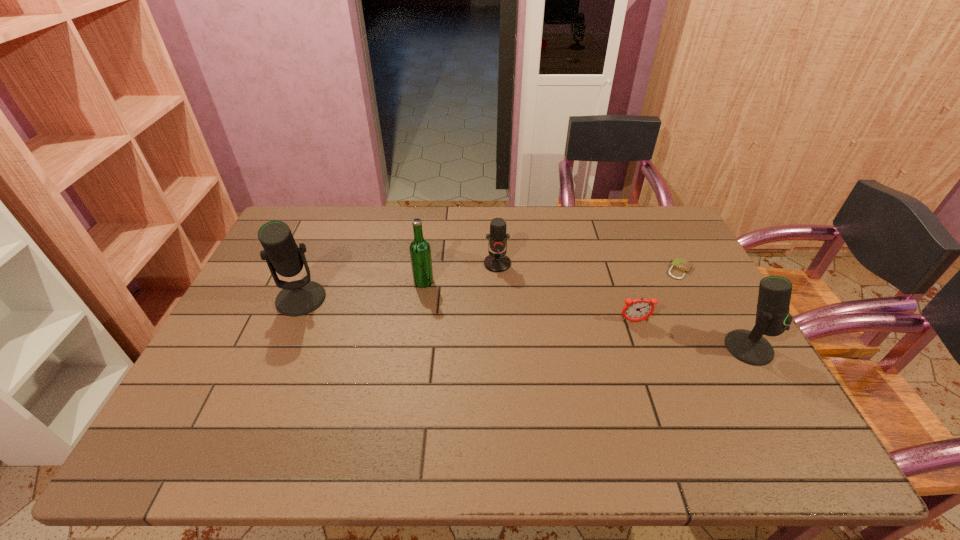
The image size is (960, 540). Identify the location of the tallest microphone. (300, 297).

You are a GUI agent. You are given a task and a screenshot of the screen. Output one action in this format:
    pyautogui.click(x=<x>, y=<y>)
    Task: Click on the second farthest microphone
    The width and height of the screenshot is (960, 540).
    Given the screenshot: What is the action you would take?
    pyautogui.click(x=300, y=297)

Identify the location of the rightmost microphone. (772, 316).

Locate an element on the screen. the nearest microphone is located at coordinates (772, 316).

Locate an element on the screen. This screenshot has width=960, height=540. the second nearest object is located at coordinates (641, 309).

Locate an element on the screen. the fifth tallest object is located at coordinates (641, 309).

Locate an element on the screen. This screenshot has width=960, height=540. beer bottle is located at coordinates (420, 252).

Find the location of a particular element. the second microphone from right to left is located at coordinates (496, 262).

Find the location of a particular element. the shortest microphone is located at coordinates (496, 262).

I want to click on padlock, so click(x=678, y=264).